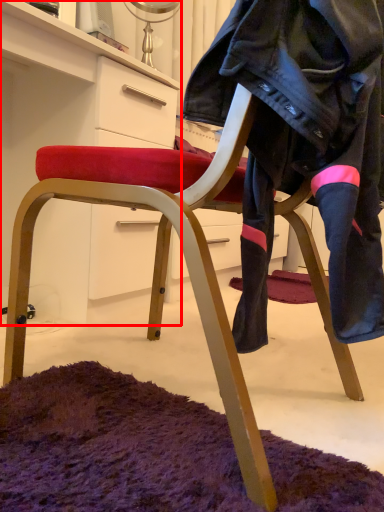
Question: From the image's perspective, considering the relative positions of cabinetry (annotated by the red box) and leather jacket in the image provided, where is cabinetry (annotated by the red box) located with respect to the staircase?

Choices:
 (A) above
 (B) below

Answer: (A)